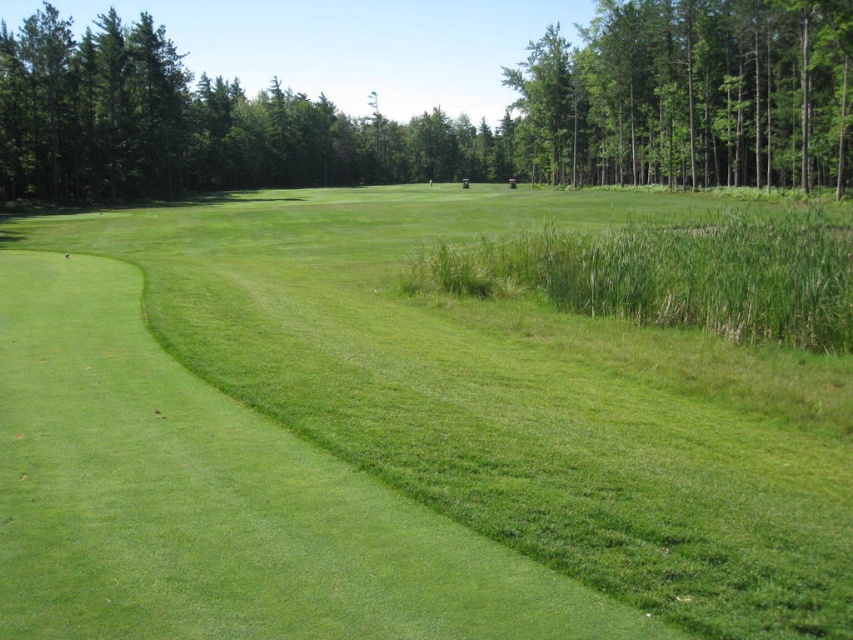
Consider the image. You are standing at the point marked by the coordinates point (440, 109) on the golf course. What object is directly above you?

The point (440, 109) marks green leafy tree at upper center, so the object directly above you is the green leafy tree at upper center.

You are a golfer standing at the tee box on the golf course. You want to hit your ball towards the green leafy tree at upper center. Based on the coordinates provided, in which general direction should you aim your shot? Please specify the direction as a cardinal direction like North, South, East, or West.

The green leafy tree at upper center is located at coordinates point (440, 109). Since the coordinate system typically places (0, 0) at the bottom left corner, the tree is positioned towards the upper left area of the image. Therefore, you should aim your shot towards the Northwest direction to reach the green leafy tree at upper center.